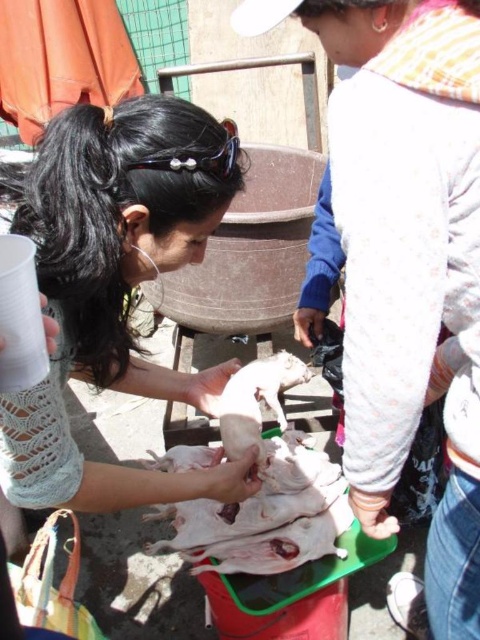
Does matte white shirt at center have a larger size compared to white raw meat at center?

Yes.

Is point (107, 472) farther from viewer compared to point (271, 554)?

No, it is in front of (271, 554).

This screenshot has height=640, width=480. I want to click on matte white shirt at center, so click(113, 285).

This screenshot has width=480, height=640. What are the coordinates of `matte white shirt at center` in the screenshot? It's located at (113, 285).

Is white raw meat at center below white smooth piglet at center?

Indeed, white raw meat at center is positioned under white smooth piglet at center.

Between point (302, 467) and point (300, 381), which one is positioned in front?

Point (302, 467) is in front.

Which is behind, point (283, 536) or point (284, 426)?

Positioned behind is point (284, 426).

Where is `white raw meat at center`? The height and width of the screenshot is (640, 480). white raw meat at center is located at coordinates (269, 516).

Is matte white shirt at center behind black plastic goggles at upper center?

That is False.

Is matte white shirt at center to the right of black plastic goggles at upper center from the viewer's perspective?

Incorrect, matte white shirt at center is not on the right side of black plastic goggles at upper center.

Is point (3, 451) positioned behind point (232, 147)?

That is False.

At what (x,y) coordinates should I click in order to perform the action: click on matte white shirt at center. Please return your answer as a coordinate pair (x, y). This screenshot has height=640, width=480. Looking at the image, I should click on click(x=113, y=285).